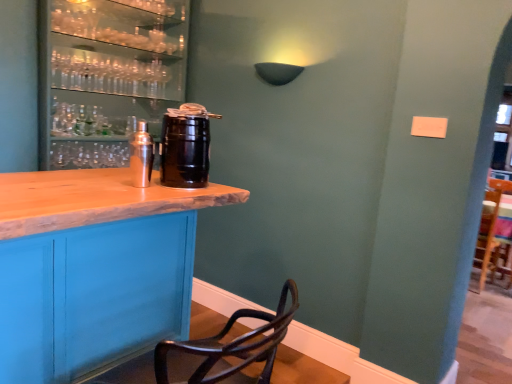
Question: Is black matte keg at center, the first beverage from the right, completely or partially inside shiny silver shaker at center, which is counted as the second beverage, starting from the right?

Choices:
 (A) yes
 (B) no

Answer: (B)

Question: From the image's perspective, is shiny silver shaker at center, which is counted as the second beverage, starting from the right, above black matte keg at center, the second beverage positioned from the left?

Choices:
 (A) no
 (B) yes

Answer: (A)

Question: Considering the relative sizes of shiny silver shaker at center, which is counted as the second beverage, starting from the right, and black matte keg at center, the second beverage positioned from the left, in the image provided, is shiny silver shaker at center, which is counted as the second beverage, starting from the right, shorter than black matte keg at center, the second beverage positioned from the left,?

Choices:
 (A) yes
 (B) no

Answer: (A)

Question: Is shiny silver shaker at center, the first beverage in the left-to-right sequence, oriented away from black matte keg at center, the first beverage from the right?

Choices:
 (A) no
 (B) yes

Answer: (A)

Question: Does shiny silver shaker at center, the first beverage in the left-to-right sequence, have a lesser width compared to black matte keg at center, the second beverage positioned from the left?

Choices:
 (A) yes
 (B) no

Answer: (A)

Question: From a real-world perspective, is shiny silver shaker at center, the first beverage in the left-to-right sequence, physically below black matte keg at center, the first beverage from the right?

Choices:
 (A) no
 (B) yes

Answer: (B)

Question: Is the position of black matte keg at center, the first beverage from the right, more distant than that of matte black barrel at left?

Choices:
 (A) no
 (B) yes

Answer: (A)

Question: Is the surface of black matte keg at center, the first beverage from the right, in direct contact with matte black barrel at left?

Choices:
 (A) no
 (B) yes

Answer: (A)

Question: From a real-world perspective, is black matte keg at center, the second beverage positioned from the left, under matte black barrel at left?

Choices:
 (A) no
 (B) yes

Answer: (B)

Question: Is black matte keg at center, the second beverage positioned from the left, to the right of matte black barrel at left from the viewer's perspective?

Choices:
 (A) no
 (B) yes

Answer: (B)

Question: Considering the relative sizes of black matte keg at center, the second beverage positioned from the left, and matte black barrel at left in the image provided, is black matte keg at center, the second beverage positioned from the left, bigger than matte black barrel at left?

Choices:
 (A) yes
 (B) no

Answer: (B)

Question: From the image's perspective, is black matte keg at center, the second beverage positioned from the left, located beneath matte black barrel at left?

Choices:
 (A) no
 (B) yes

Answer: (B)

Question: Is matte black barrel at left thinner than shiny silver shaker at center, the first beverage in the left-to-right sequence?

Choices:
 (A) yes
 (B) no

Answer: (B)